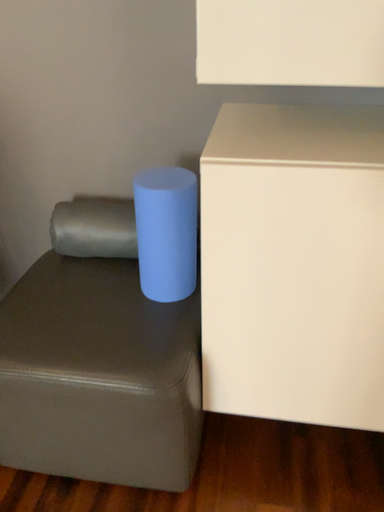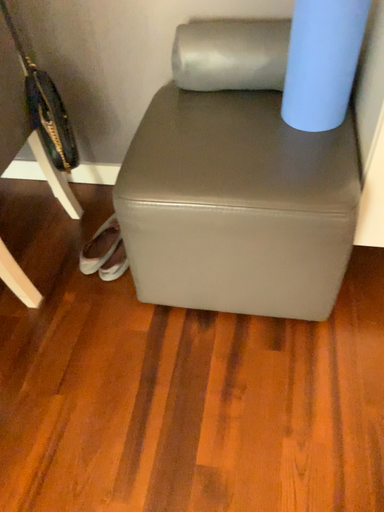
Question: How did the camera likely rotate when shooting the video?

Choices:
 (A) rotated upward
 (B) rotated downward

Answer: (B)